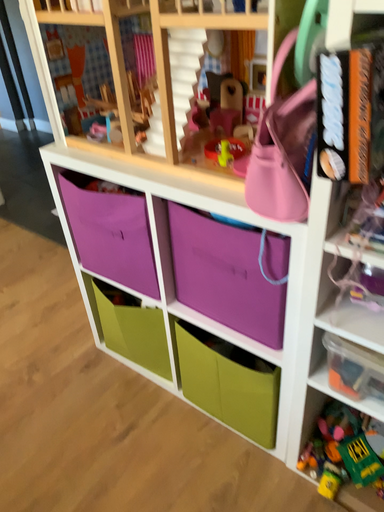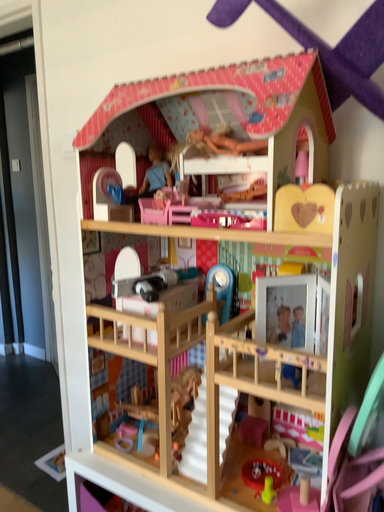
Question: Which way did the camera rotate in the video?

Choices:
 (A) rotated upward
 (B) rotated downward

Answer: (A)